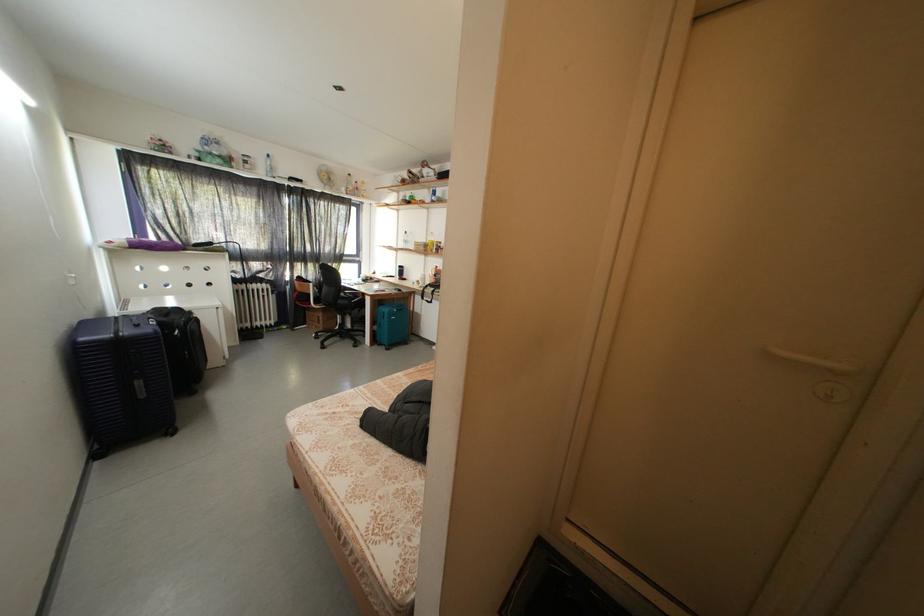
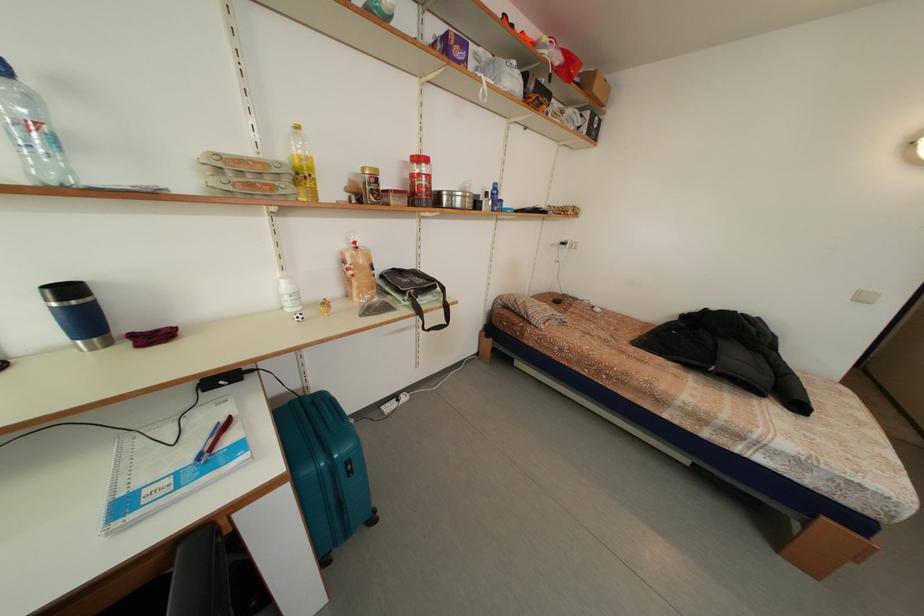
Find the pixel in the second image that matches pixel 408 272 in the first image.

(78, 296)